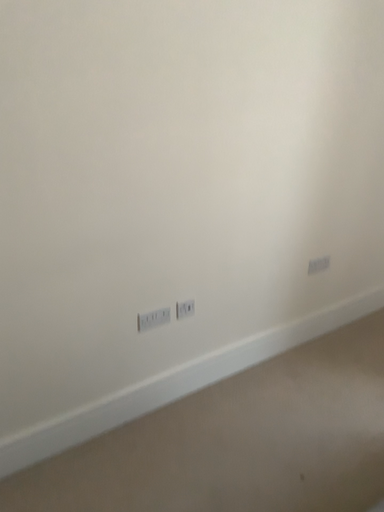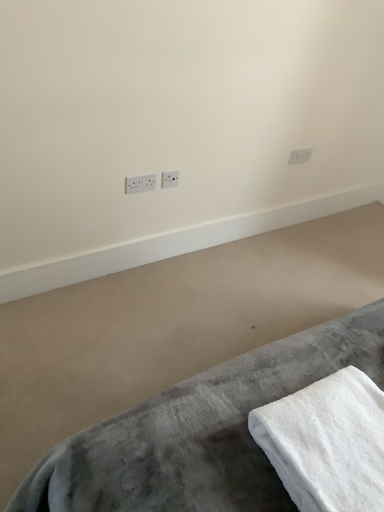
Question: Which way did the camera rotate in the video?

Choices:
 (A) rotated downward
 (B) rotated upward

Answer: (A)